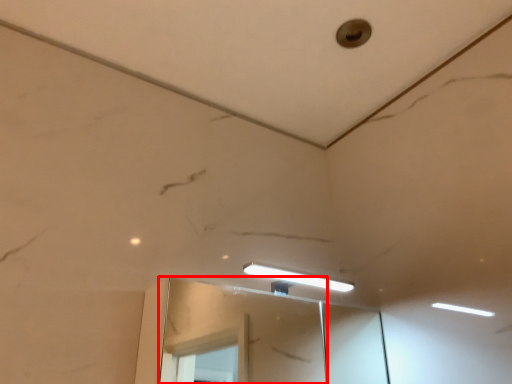
Question: Considering the relative positions of mirror (annotated by the red box) and hole in the image provided, where is mirror (annotated by the red box) located with respect to the staircase?

Choices:
 (A) left
 (B) right

Answer: (A)